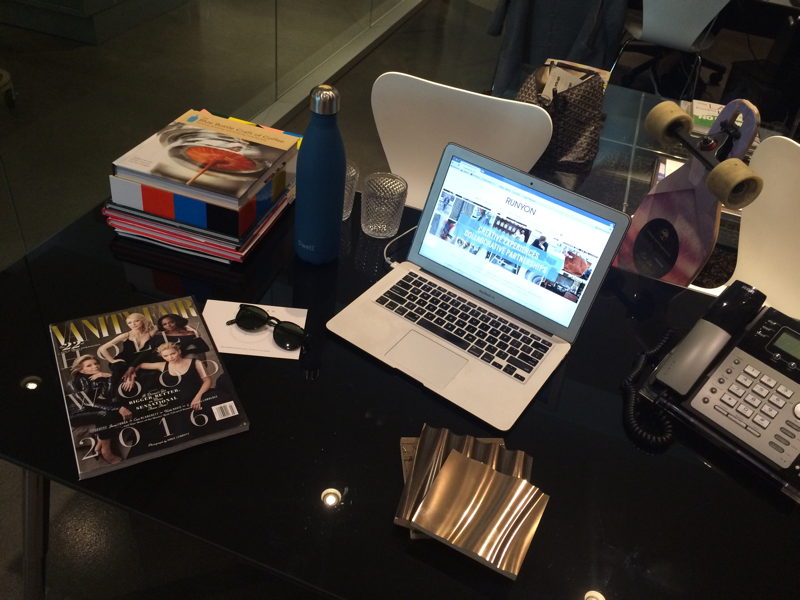
What are the coordinates of `screen` in the screenshot? It's located at (504, 277).